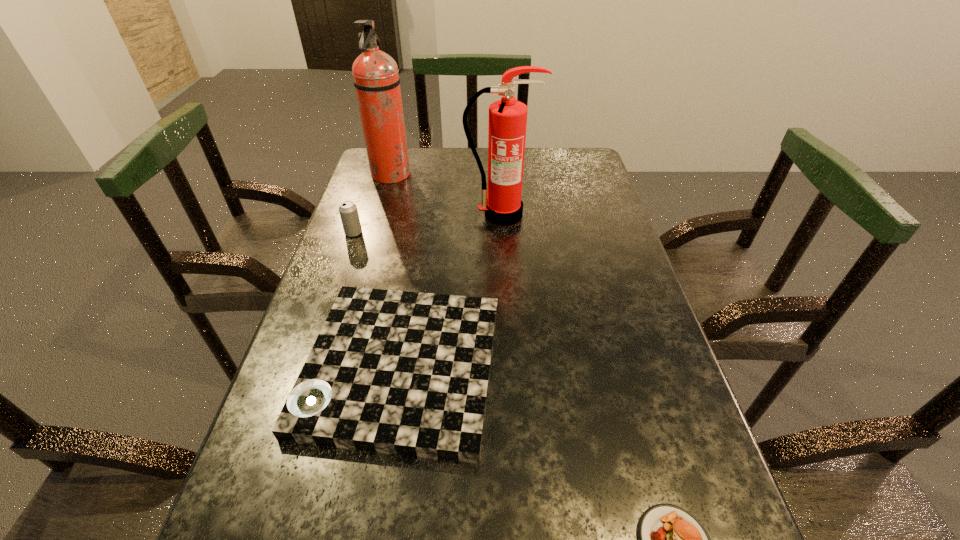
This screenshot has height=540, width=960. I want to click on vacant space located 0.090m on the right of the fourth farthest object, so click(x=545, y=367).

At what (x,y) coordinates should I click in order to perform the action: click on object situated at the far edge. Please return your answer as a coordinate pair (x, y). Looking at the image, I should click on (376, 78).

Where is `fire extinguisher present at the left edge`? This screenshot has height=540, width=960. fire extinguisher present at the left edge is located at coordinates (376, 78).

Where is `beer can situated at the left edge`? beer can situated at the left edge is located at coordinates (348, 211).

Where is `checkerboard that is at the left edge`? checkerboard that is at the left edge is located at coordinates (407, 373).

Locate an element on the screen. The height and width of the screenshot is (540, 960). object positioned at the far left corner is located at coordinates (376, 78).

Where is `free point at the far edge`? The image size is (960, 540). free point at the far edge is located at coordinates (422, 182).

Locate an element on the screen. This screenshot has width=960, height=540. vacant space at the left edge is located at coordinates (257, 438).

This screenshot has height=540, width=960. Find the location of `vacant space at the far right corner`. vacant space at the far right corner is located at coordinates (549, 181).

Identify the location of free space between the beer can and the right fire extinguisher. Image resolution: width=960 pixels, height=540 pixels. (427, 224).